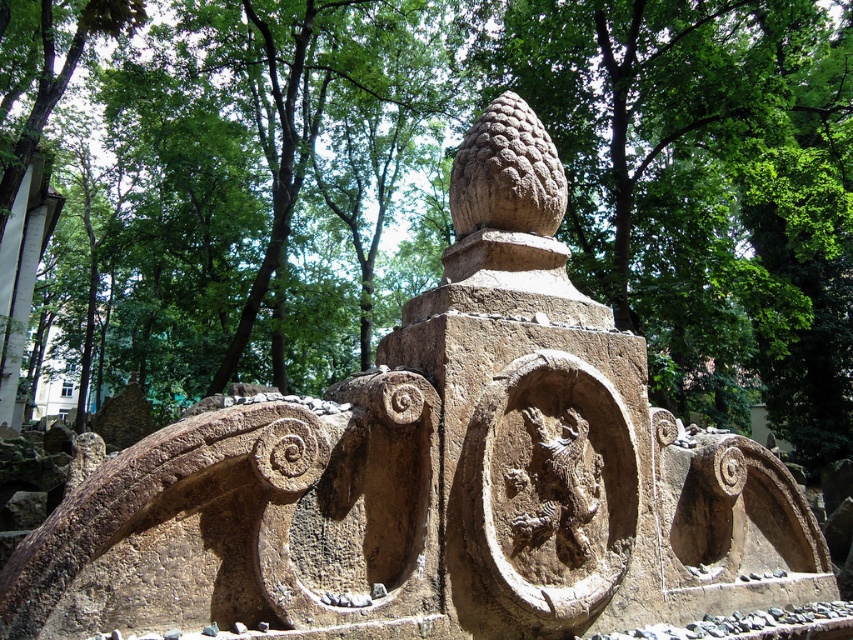
Question: Does brown stone tree at center have a lesser width compared to rough stone dragon at center?

Choices:
 (A) no
 (B) yes

Answer: (A)

Question: Is brown stone tree at center below rough stone dragon at center?

Choices:
 (A) yes
 (B) no

Answer: (B)

Question: Among these objects, which one is nearest to the camera?

Choices:
 (A) rough stone dragon at center
 (B) brown stone tree at center

Answer: (A)

Question: Can you confirm if brown stone tree at center is positioned above rough stone dragon at center?

Choices:
 (A) no
 (B) yes

Answer: (B)